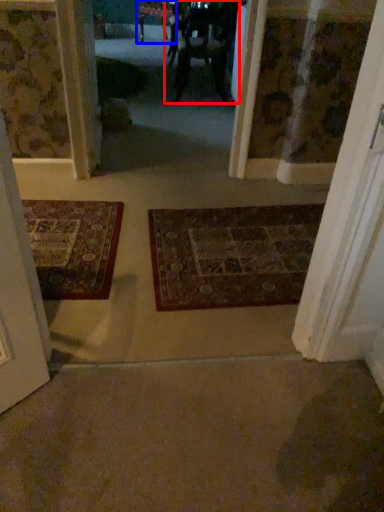
Question: Which object appears farthest to the camera in this image, couple (highlighted by a red box) or furniture (highlighted by a blue box)?

Choices:
 (A) couple
 (B) furniture

Answer: (B)